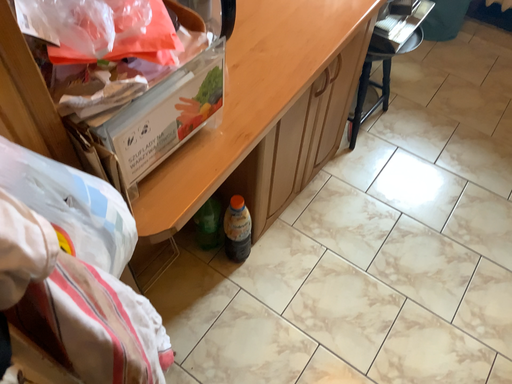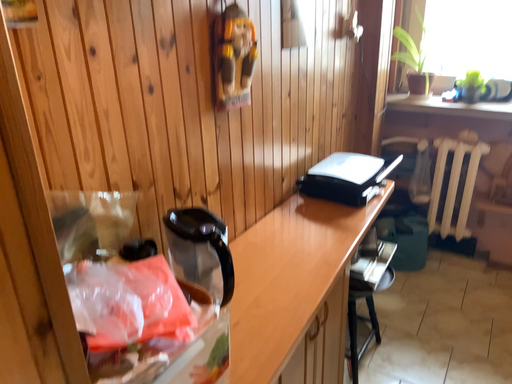
Question: Which way did the camera rotate in the video?

Choices:
 (A) rotated downward
 (B) rotated upward

Answer: (B)